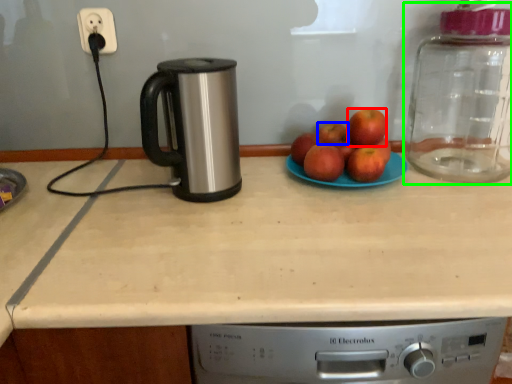
Question: Considering the real-world distances, which object is closest to apple (highlighted by a red box)? apple (highlighted by a blue box) or glass jar (highlighted by a green box).

Choices:
 (A) apple
 (B) glass jar

Answer: (A)